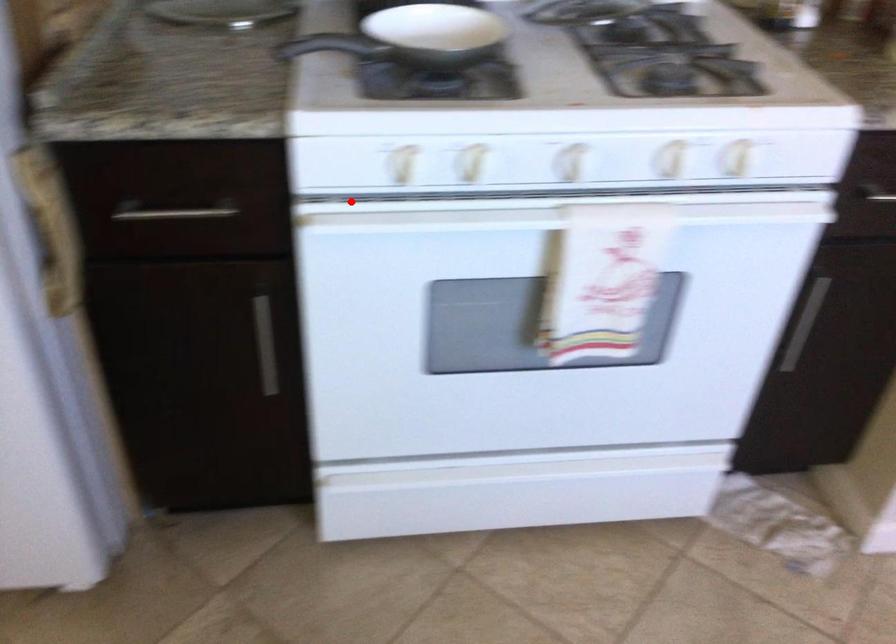
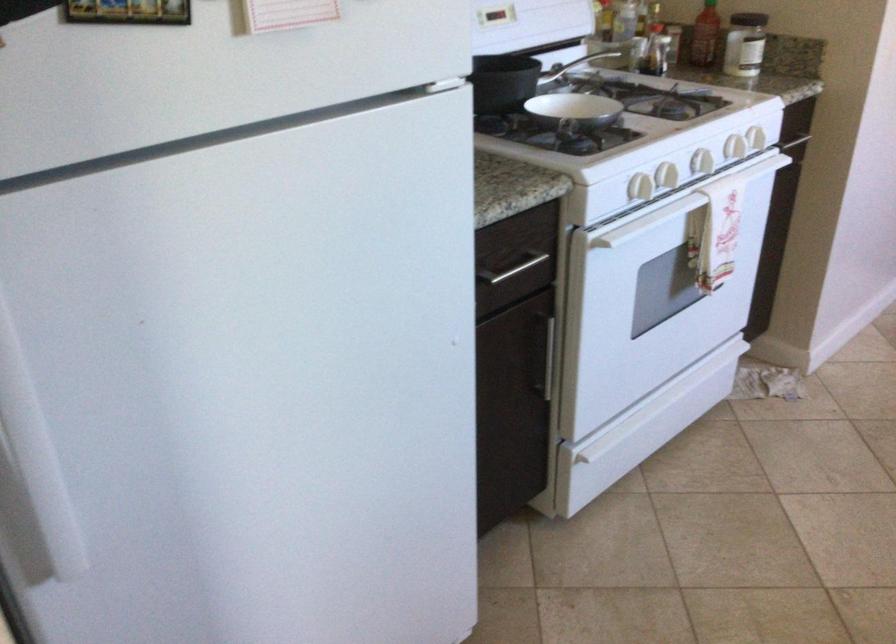
Where in the second image is the point corresponding to the highlighted location from the first image?

(640, 187)